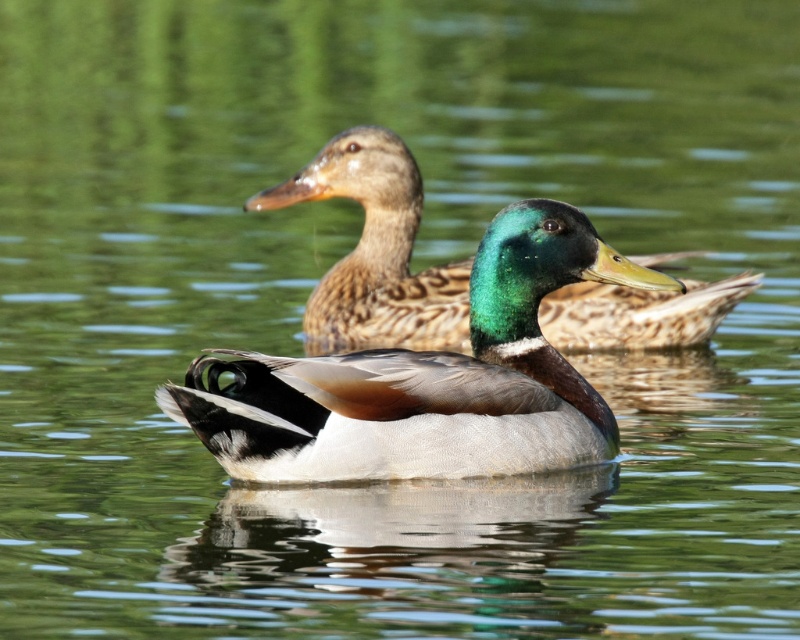
You are observing two ducks in the water. The scene includes a shiny green head at center and a green glossy head at center. Which duck has its head positioned lower in the image?

The shiny green head at center is located below the green glossy head at center, so the duck with the shiny green head at center has its head positioned lower in the image.

From the picture: You are a birdwatcher standing near the pond. You see two ducks in the water. The first duck has a shiny green head at center and the second has a green glossy head at center. Which duck is closer to you?

The shiny green head at center is closer to you because it is only 1.81 meters away from the green glossy head at center, implying that the shiny green head is in front of the other.